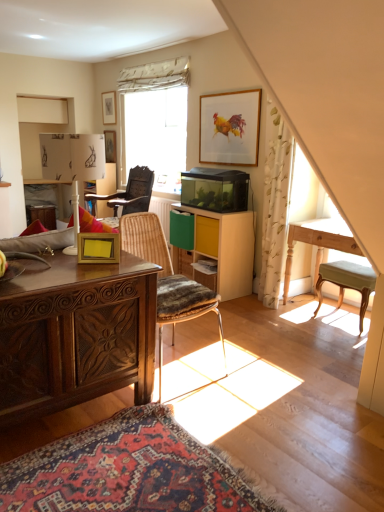
Image resolution: width=384 pixels, height=512 pixels. I want to click on free space underneath rustic wood chair at center, marked as the 1th chair in a front-to-back arrangement (from a real-world perspective), so click(185, 376).